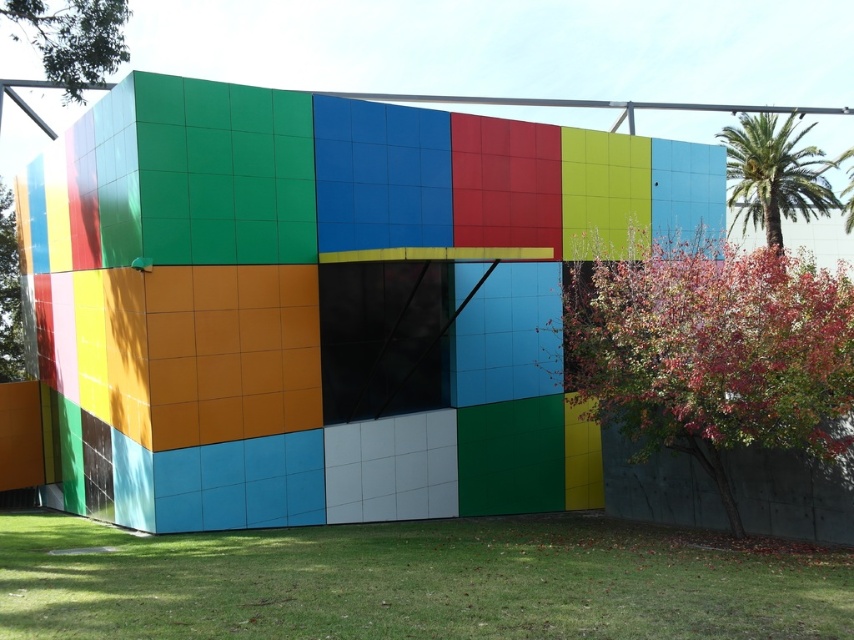
You are standing in front of the modern building and want to walk towards the green leafy palm tree at upper right. Which direction should you move relative to the green grass at lower center?

Since the green grass at lower center is closer to the viewer than the green leafy palm tree at upper right, you should move towards the upper right direction away from the green grass at lower center to reach the palm tree.

You are standing in front of the modern building and notice the green grass at lower center and the green leafy palm tree at upper right. Which object is positioned more to the left side of the scene?

The green grass at lower center is positioned more to the left side of the scene compared to the green leafy palm tree at upper right.

You are standing in front of a modern building with a geometric design. You notice green grass at lower center and a green leafy palm tree at upper right. Which of these two objects takes up more area in the scene?

→ The green leafy palm tree at upper right occupies more space than the green grass at lower center.